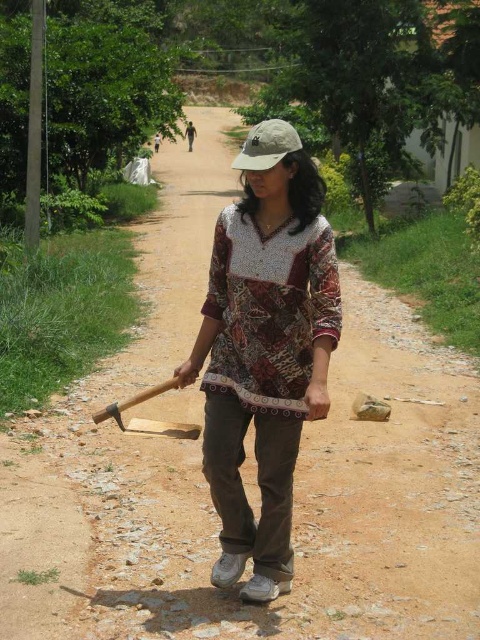
Question: Which object appears closest to the camera in this image?

Choices:
 (A) batik fabric shirt at center
 (B) khaki fabric baseball cap at center

Answer: (A)

Question: Does batik fabric shirt at center have a larger size compared to khaki fabric baseball cap at center?

Choices:
 (A) no
 (B) yes

Answer: (A)

Question: Can you confirm if batik fabric shirt at center is thinner than khaki fabric baseball cap at center?

Choices:
 (A) no
 (B) yes

Answer: (B)

Question: Observing the image, what is the correct spatial positioning of batik fabric shirt at center in reference to khaki fabric baseball cap at center?

Choices:
 (A) below
 (B) above

Answer: (A)

Question: Among these points, which one is nearest to the camera?

Choices:
 (A) (297, 138)
 (B) (311, 353)

Answer: (A)